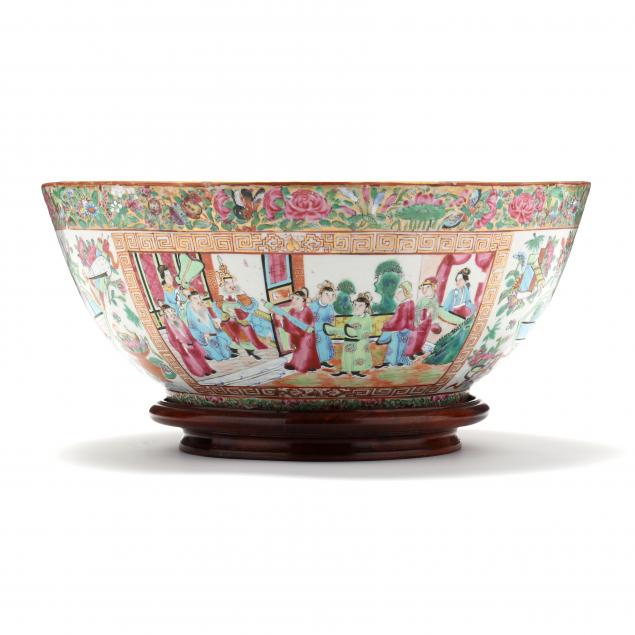
Locate an element on the screen. Image resolution: width=635 pixels, height=635 pixels. fabric is located at coordinates (279, 308).